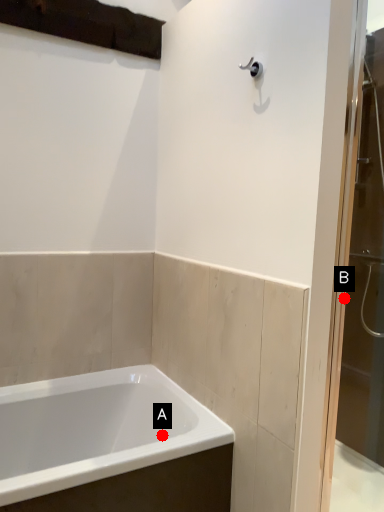
Question: Two points are circled on the image, labeled by A and B beside each circle. Which of the following is the closest to the observer?

Choices:
 (A) A is closer
 (B) B is closer

Answer: (A)